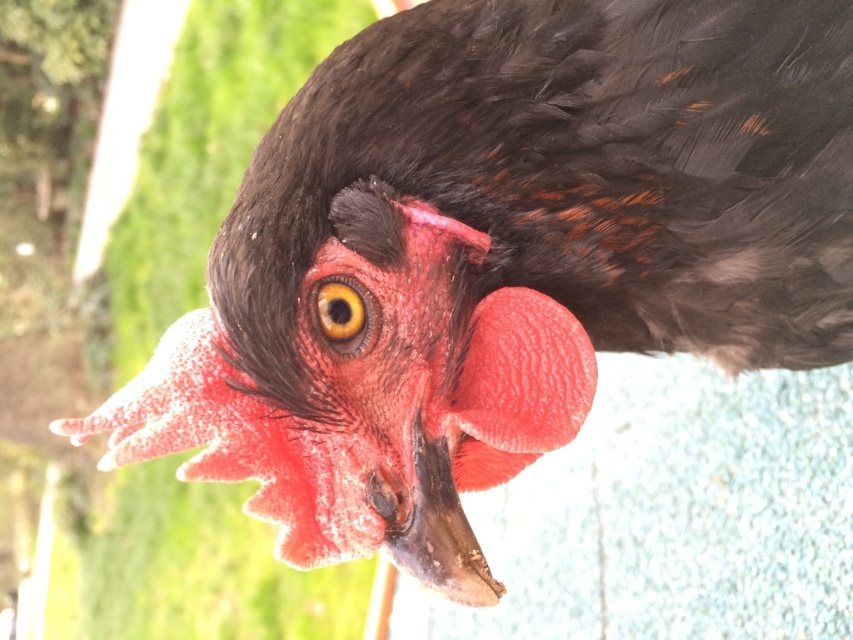
Measure the distance between slick black beak at center and yellow shiny eye at center.

slick black beak at center and yellow shiny eye at center are 4.36 inches apart.

Which of these two, slick black beak at center or yellow shiny eye at center, stands shorter?

yellow shiny eye at center

Where is `slick black beak at center`? This screenshot has height=640, width=853. slick black beak at center is located at coordinates tap(439, 531).

This screenshot has width=853, height=640. I want to click on slick black beak at center, so click(x=439, y=531).